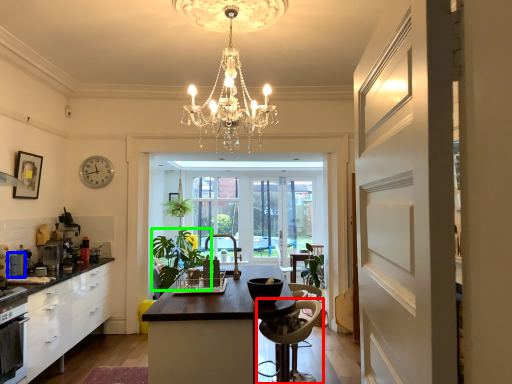
Question: Which is farther away from chair (highlighted by a red box)? appliance (highlighted by a blue box) or plant (highlighted by a green box)?

Choices:
 (A) appliance
 (B) plant

Answer: (B)